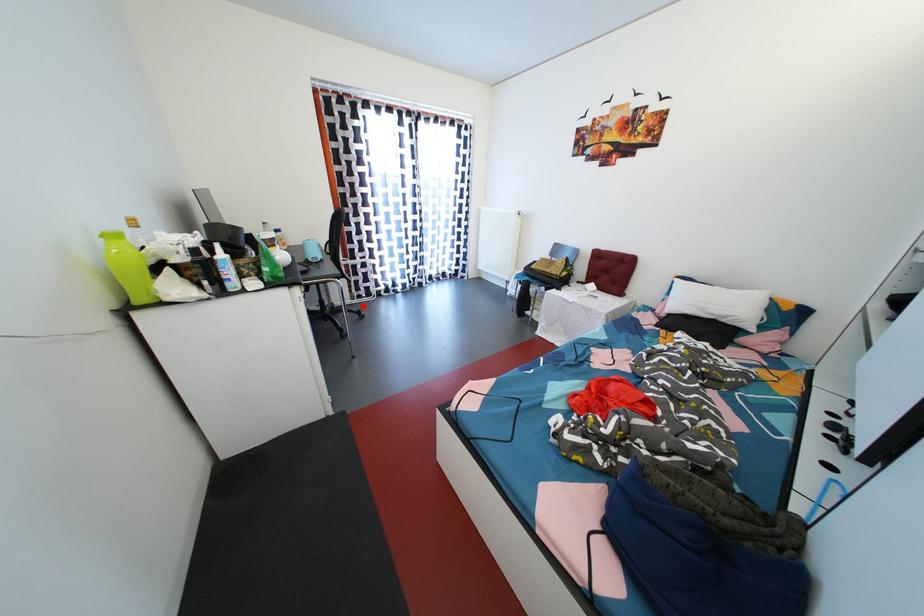
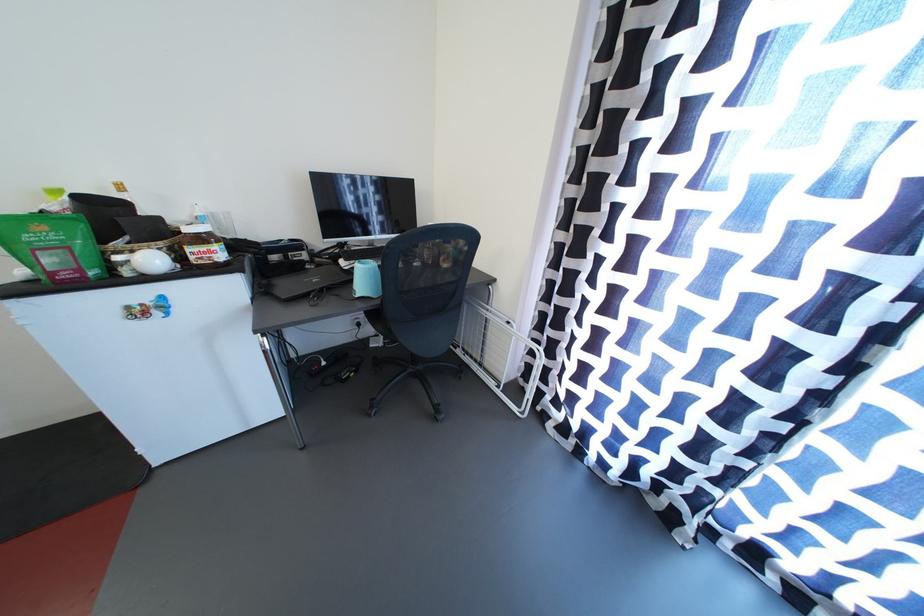
In the second image, find the point that corresponds to the highlighted location in the first image.

(505, 397)